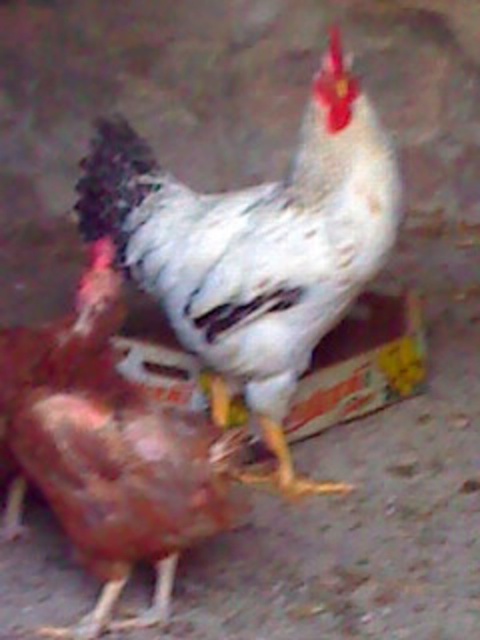
Between white matte chicken at center and shiny brown chicken at center, which one is positioned lower?

Positioned lower is shiny brown chicken at center.

Which is more to the left, white matte chicken at center or shiny brown chicken at center?

shiny brown chicken at center is more to the left.

Is point (84, 211) closer to viewer compared to point (74, 355)?

No, it is behind (74, 355).

The height and width of the screenshot is (640, 480). What are the coordinates of `white matte chicken at center` in the screenshot? It's located at (254, 248).